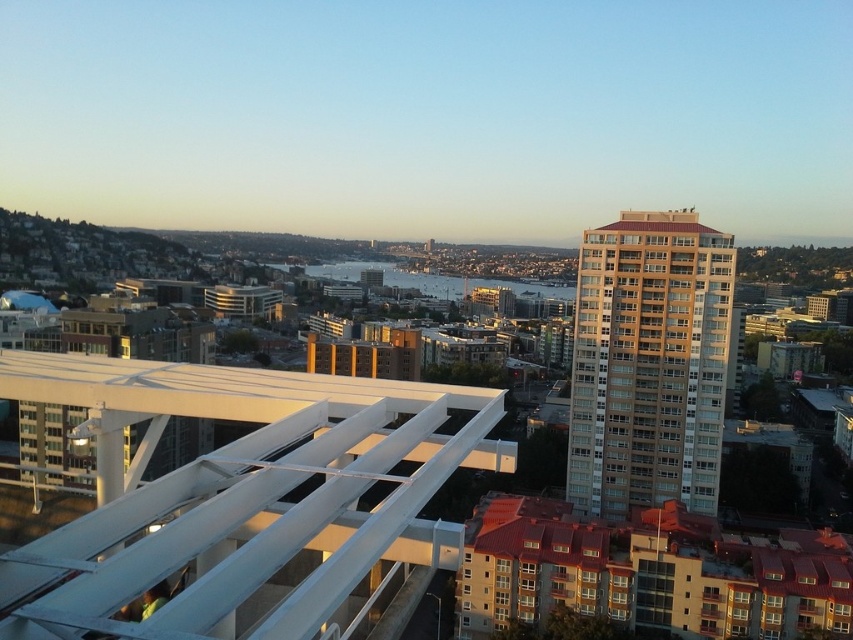
Question: Does white metallic rail at center appear over beige concrete building at right?

Choices:
 (A) yes
 (B) no

Answer: (B)

Question: Can you confirm if white metallic rail at center is thinner than beige concrete building at right?

Choices:
 (A) no
 (B) yes

Answer: (A)

Question: Which object is farther from the camera taking this photo?

Choices:
 (A) white metallic rail at center
 (B) beige concrete building at right

Answer: (B)

Question: Is white metallic rail at center wider than beige concrete building at right?

Choices:
 (A) no
 (B) yes

Answer: (B)